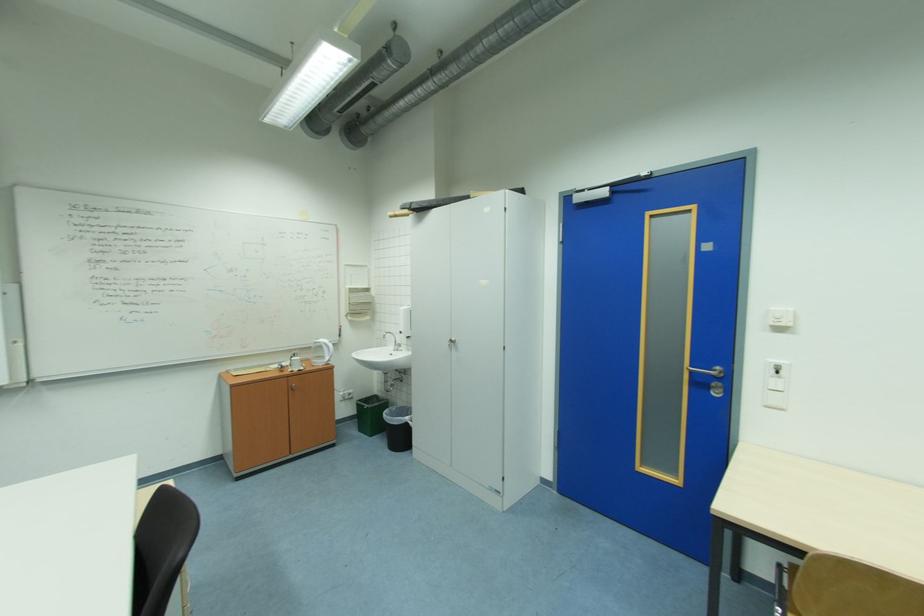
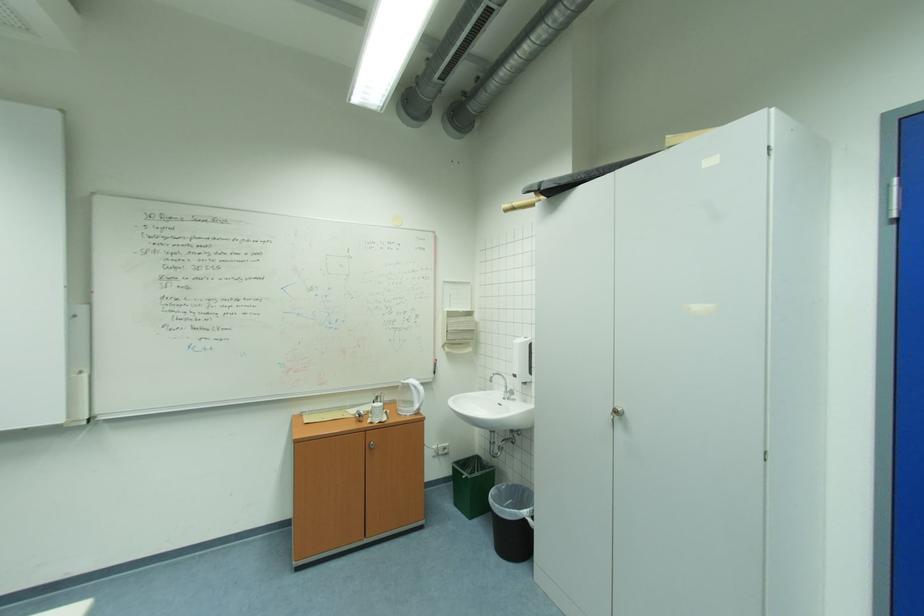
Where in the second image is the point corresponding to [298,371] from the first image?

(377, 422)